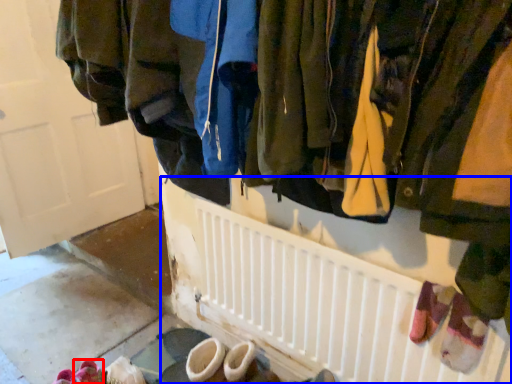
Question: Which object appears farthest to the camera in this image, footwear (highlighted by a red box) or radiator (highlighted by a blue box)?

Choices:
 (A) footwear
 (B) radiator

Answer: (A)